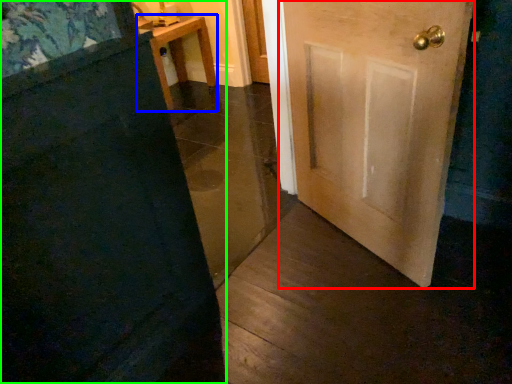
Question: Based on their relative distances, which object is nearer to door (highlighted by a red box)? Choose from furniture (highlighted by a blue box) and door (highlighted by a green box).

Choices:
 (A) furniture
 (B) door

Answer: (B)